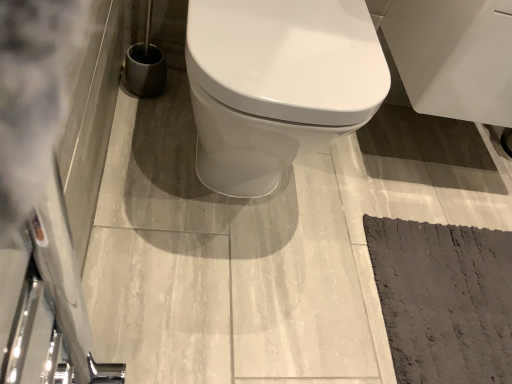
Question: From their relative heights in the image, would you say dark gray textured mat at lower right is taller or shorter than white glossy cabinet at upper right?

Choices:
 (A) short
 (B) tall

Answer: (A)

Question: From the image's perspective, relative to white glossy cabinet at upper right, is dark gray textured mat at lower right above or below?

Choices:
 (A) below
 (B) above

Answer: (A)

Question: In the image, is dark gray textured mat at lower right positioned in front of or behind white glossy cabinet at upper right?

Choices:
 (A) behind
 (B) front

Answer: (A)

Question: In terms of width, does white glossy cabinet at upper right look wider or thinner when compared to dark gray textured mat at lower right?

Choices:
 (A) wide
 (B) thin

Answer: (B)

Question: From a real-world perspective, is white glossy cabinet at upper right physically located above or below dark gray textured mat at lower right?

Choices:
 (A) above
 (B) below

Answer: (A)

Question: In the image, is white glossy cabinet at upper right positioned in front of or behind dark gray textured mat at lower right?

Choices:
 (A) front
 (B) behind

Answer: (A)

Question: Which is correct: white glossy cabinet at upper right is inside dark gray textured mat at lower right, or outside of it?

Choices:
 (A) outside
 (B) inside

Answer: (A)